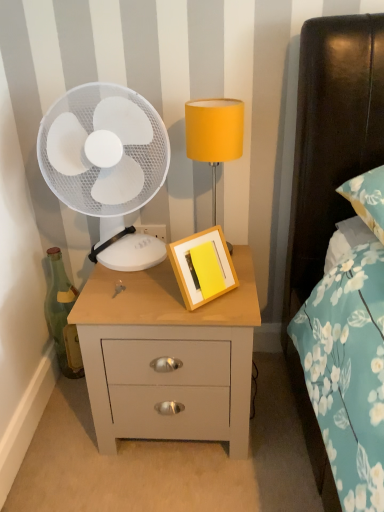
Question: From a real-world perspective, is green glass bottle at left positioned over yellow fabric lampshade at upper center based on gravity?

Choices:
 (A) no
 (B) yes

Answer: (A)

Question: Does green glass bottle at left appear on the left side of yellow fabric lampshade at upper center?

Choices:
 (A) yes
 (B) no

Answer: (A)

Question: From the image's perspective, would you say green glass bottle at left is positioned over yellow fabric lampshade at upper center?

Choices:
 (A) no
 (B) yes

Answer: (A)

Question: Is green glass bottle at left further to the viewer compared to yellow fabric lampshade at upper center?

Choices:
 (A) yes
 (B) no

Answer: (A)

Question: Is there a large distance between green glass bottle at left and yellow fabric lampshade at upper center?

Choices:
 (A) no
 (B) yes

Answer: (A)

Question: Is green glass bottle at left positioned with its back to yellow fabric lampshade at upper center?

Choices:
 (A) no
 (B) yes

Answer: (A)

Question: Could you tell me if white plastic fan at left is facing wooden picture frame at center?

Choices:
 (A) yes
 (B) no

Answer: (B)

Question: Is white plastic fan at left directly adjacent to wooden picture frame at center?

Choices:
 (A) no
 (B) yes

Answer: (A)

Question: Is white plastic fan at left not near wooden picture frame at center?

Choices:
 (A) yes
 (B) no

Answer: (B)

Question: From a real-world perspective, is white plastic fan at left on wooden picture frame at center?

Choices:
 (A) yes
 (B) no

Answer: (A)

Question: Considering the relative sizes of white plastic fan at left and wooden picture frame at center in the image provided, is white plastic fan at left smaller than wooden picture frame at center?

Choices:
 (A) no
 (B) yes

Answer: (A)

Question: Does white plastic fan at left contain wooden picture frame at center?

Choices:
 (A) no
 (B) yes

Answer: (A)

Question: From a real-world perspective, does light wood/finish nightstand at center stand above yellow fabric lampshade at upper center?

Choices:
 (A) yes
 (B) no

Answer: (B)